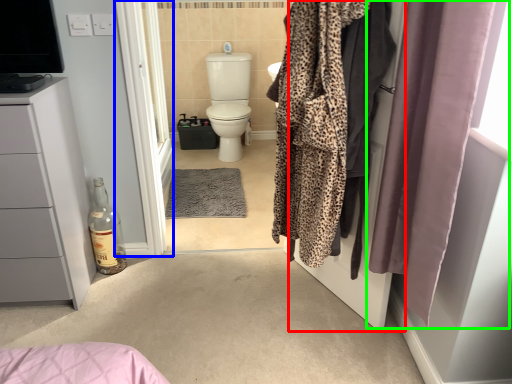
Question: Estimate the real-world distances between objects in this image. Which object is closer to screen door (highlighted by a red box), screen door (highlighted by a blue box) or curtain (highlighted by a green box)?

Choices:
 (A) screen door
 (B) curtain

Answer: (B)